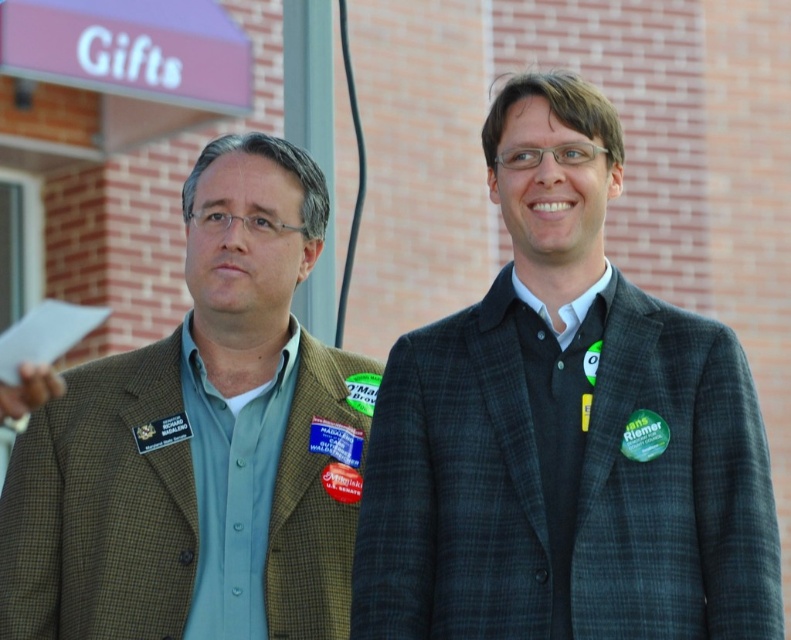
Between plaid wool blazer at center and green plaid blazer at left, which one has less height?

green plaid blazer at left is shorter.

Which is in front, point (558, 248) or point (256, 189)?

Point (558, 248) is more forward.

Which is in front, point (645, 464) or point (19, 564)?

Point (645, 464)

The image size is (791, 640). In order to click on plaid wool blazer at center in this screenshot , I will do `click(566, 429)`.